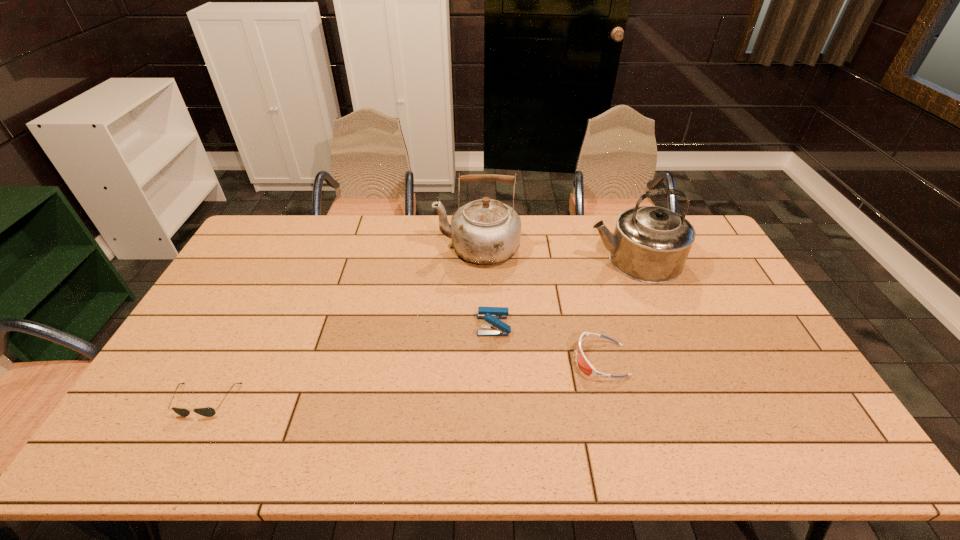
Where is `free space that satisfies the following two spatial constraints: 1. on the front-facing side of the goggles; 2. on the lenses of the sunglasses`? The height and width of the screenshot is (540, 960). free space that satisfies the following two spatial constraints: 1. on the front-facing side of the goggles; 2. on the lenses of the sunglasses is located at coordinates (611, 401).